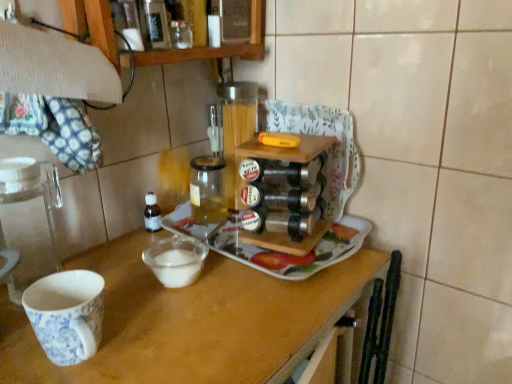
This screenshot has width=512, height=384. I want to click on free space in front of translucent glass jar at center, so click(198, 250).